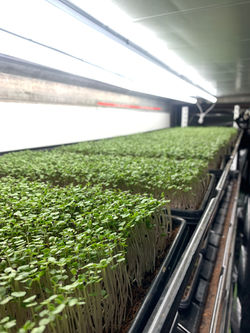
The image size is (250, 333). I want to click on empty left corner empty space, so click(x=4, y=6).